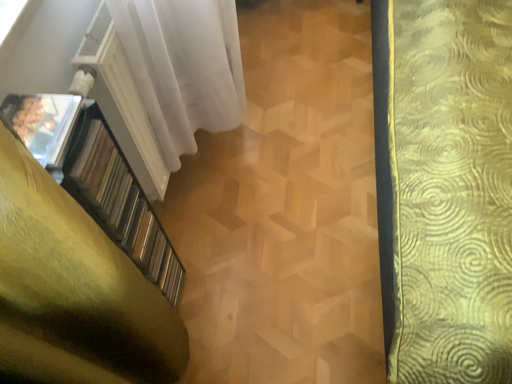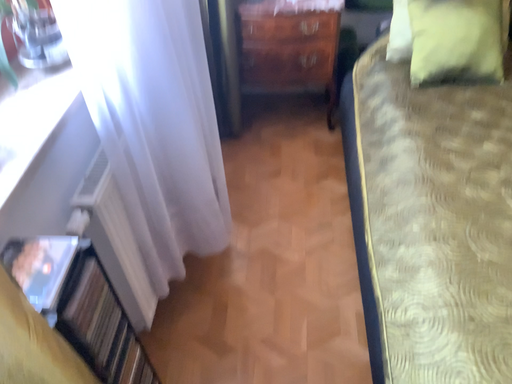
Question: Which way did the camera rotate in the video?

Choices:
 (A) rotated downward
 (B) rotated upward

Answer: (B)